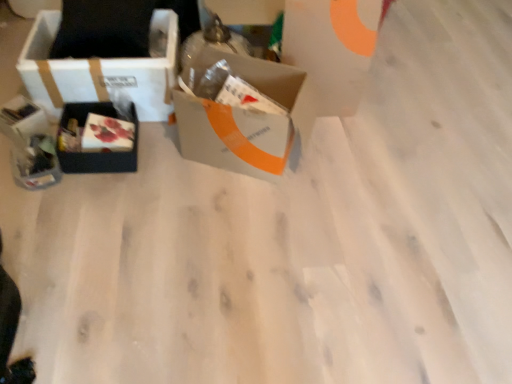
In order to click on free space to the right of matte plastic box at center-left in this screenshot , I will do `click(160, 156)`.